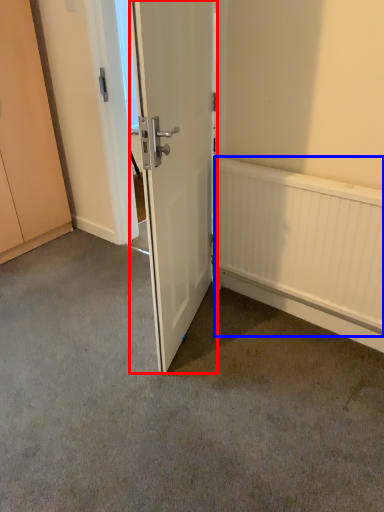
Question: Which object is further to the camera taking this photo, door (highlighted by a red box) or radiator (highlighted by a blue box)?

Choices:
 (A) door
 (B) radiator

Answer: (B)